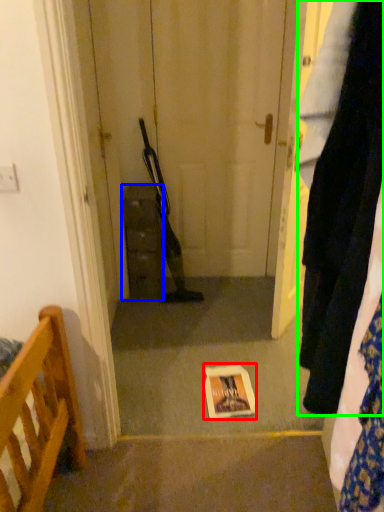
Question: Which object is the closest to the copy (highlighted by a red box)? Choose among these: cabinetry (highlighted by a blue box) or clothing (highlighted by a green box).

Choices:
 (A) cabinetry
 (B) clothing

Answer: (A)